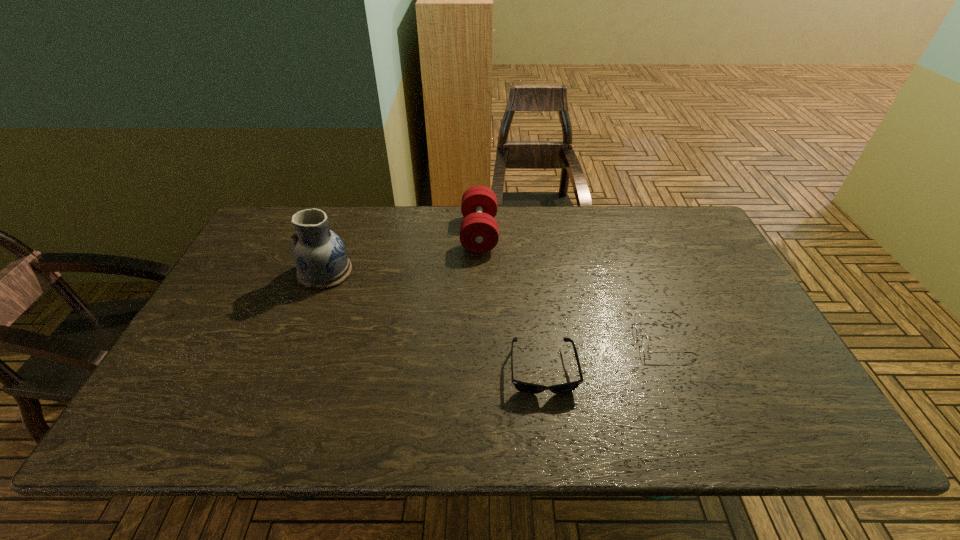
At what (x,y) coordinates should I click in order to perform the action: click on the leftmost object. Please return your answer as a coordinate pair (x, y). This screenshot has height=540, width=960. Looking at the image, I should click on (320, 256).

The image size is (960, 540). I want to click on the tallest object, so click(320, 256).

I want to click on dumbbell, so click(479, 233).

Identify the location of the third object from right to left. The image size is (960, 540). (479, 233).

Where is `sunglasses`? This screenshot has height=540, width=960. sunglasses is located at coordinates (525, 387).

You are a GUI agent. You are given a task and a screenshot of the screen. Output one action in this format:
    pyautogui.click(x=<x>, y=<y>)
    Task: Click on the rightmost object
    The height and width of the screenshot is (540, 960).
    Given the screenshot: What is the action you would take?
    pyautogui.click(x=644, y=339)

The image size is (960, 540). In order to click on vacant position located on the back of the leftmost object in this screenshot , I will do `click(338, 239)`.

Identify the location of vacant area situated on the front of the third shortest object. The image size is (960, 540). (479, 287).

This screenshot has width=960, height=540. Find the location of `vacant space located 0.070m on the front-facing side of the sunglasses`. vacant space located 0.070m on the front-facing side of the sunglasses is located at coordinates (550, 428).

In order to click on free space located on the front-facing side of the rightmost object in this screenshot , I will do `click(503, 338)`.